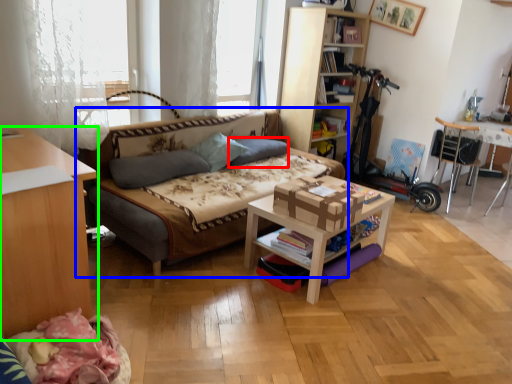
Question: Which object is positioned farthest from pillow (highlighted by a red box)? Select from studio couch (highlighted by a blue box) and desk (highlighted by a green box).

Choices:
 (A) studio couch
 (B) desk

Answer: (B)